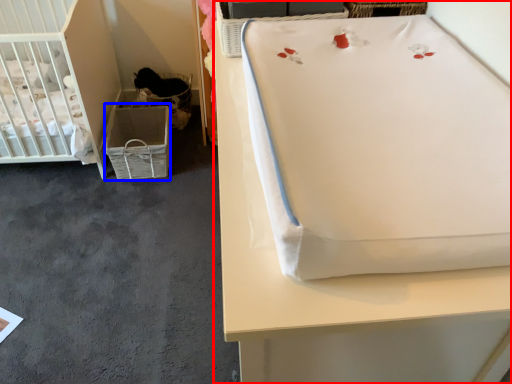
Question: Which object is closer to the camera taking this photo, furniture (highlighted by a red box) or crate (highlighted by a blue box)?

Choices:
 (A) furniture
 (B) crate

Answer: (A)